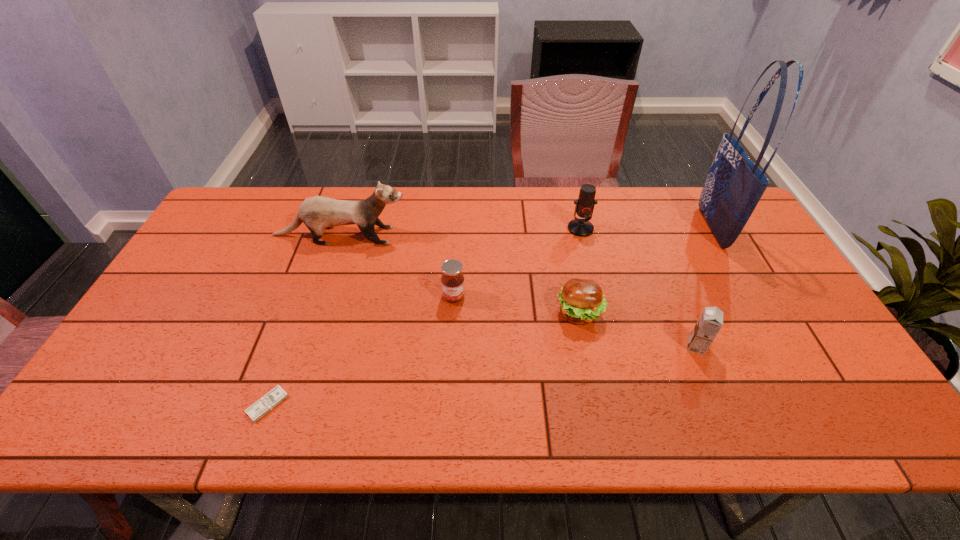
Identify the location of the rightmost object. (734, 186).

At what (x,y) coordinates should I click in order to perform the action: click on the tallest object. Please return your answer as a coordinate pair (x, y). Image resolution: width=960 pixels, height=540 pixels. Looking at the image, I should click on click(x=734, y=186).

Identify the location of the second tallest object. Image resolution: width=960 pixels, height=540 pixels. (317, 213).

At what (x,y) coordinates should I click in order to perform the action: click on microphone. Please return your answer as a coordinate pair (x, y). This screenshot has height=540, width=960. Looking at the image, I should click on (585, 203).

The image size is (960, 540). Identify the location of the sixth object from left to right. (708, 325).

I want to click on chocolate milk, so click(x=708, y=325).

Where is `jam`? This screenshot has width=960, height=540. jam is located at coordinates (452, 280).

The image size is (960, 540). In order to click on hamburger in this screenshot , I will do `click(582, 301)`.

You are a GUI agent. You are given a task and a screenshot of the screen. Output one action in this format:
    pyautogui.click(x=<x>, y=<y>)
    Task: Click on the money
    The image size is (960, 540).
    Given the screenshot: What is the action you would take?
    pyautogui.click(x=265, y=404)

At what (x,y) coordinates should I click in order to perform the action: click on the nearest object. Please return your answer as a coordinate pair (x, y). This screenshot has height=540, width=960. Looking at the image, I should click on (265, 404).